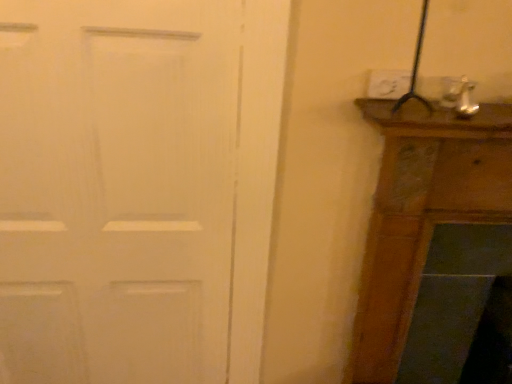
At what (x,y) coordinates should I click in order to perform the action: click on white plastic electric outlet at upper right. Please return your answer as a coordinate pair (x, y). The width and height of the screenshot is (512, 384). Looking at the image, I should click on (388, 84).

The width and height of the screenshot is (512, 384). What do you see at coordinates (388, 84) in the screenshot? I see `white plastic electric outlet at upper right` at bounding box center [388, 84].

Image resolution: width=512 pixels, height=384 pixels. Describe the element at coordinates (117, 189) in the screenshot. I see `white matte door at left` at that location.

Locate an element on the screen. white matte door at left is located at coordinates (117, 189).

Where is `white plastic electric outlet at upper right`? The image size is (512, 384). white plastic electric outlet at upper right is located at coordinates (388, 84).

Is white matte door at left at the left side of white plastic electric outlet at upper right?

Yes, white matte door at left is to the left of white plastic electric outlet at upper right.

Is white matte door at left in front of or behind white plastic electric outlet at upper right in the image?

Clearly, white matte door at left is in front of white plastic electric outlet at upper right.

Considering the positions of points (129, 63) and (401, 93), is point (129, 63) farther from camera compared to point (401, 93)?

That is False.

From the image's perspective, who appears lower, white matte door at left or white plastic electric outlet at upper right?

white matte door at left.

From a real-world perspective, is white matte door at left on white plastic electric outlet at upper right?

Actually, white matte door at left is physically below white plastic electric outlet at upper right in the real world.

Considering the sizes of objects white matte door at left and white plastic electric outlet at upper right in the image provided, who is thinner, white matte door at left or white plastic electric outlet at upper right?

Thinner between the two is white plastic electric outlet at upper right.

Considering the sizes of white matte door at left and white plastic electric outlet at upper right in the image, is white matte door at left taller or shorter than white plastic electric outlet at upper right?

white matte door at left is taller than white plastic electric outlet at upper right.

Who is smaller, white matte door at left or white plastic electric outlet at upper right?

white plastic electric outlet at upper right.

Can we say white matte door at left lies outside white plastic electric outlet at upper right?

That's correct, white matte door at left is outside of white plastic electric outlet at upper right.

Are white matte door at left and white plastic electric outlet at upper right located far from each other?

No, there isn't a large distance between white matte door at left and white plastic electric outlet at upper right.

Is white matte door at left facing towards white plastic electric outlet at upper right?

No, white matte door at left does not turn towards white plastic electric outlet at upper right.

What's the angular difference between white matte door at left and white plastic electric outlet at upper right's facing directions?

white matte door at left and white plastic electric outlet at upper right are facing 4.25 degrees away from each other.

There is a white matte door at left. Identify the location of electric outlet above it (from a real-world perspective). (388, 84).

Visually, is white plastic electric outlet at upper right positioned to the left or to the right of white matte door at left?

From the image, it's evident that white plastic electric outlet at upper right is to the right of white matte door at left.

Is white plastic electric outlet at upper right in front of or behind white matte door at left in the image?

white plastic electric outlet at upper right is behind white matte door at left.

Does point (400, 95) lie behind point (159, 277)?

No, (400, 95) is in front of (159, 277).

From the image's perspective, which is above, white plastic electric outlet at upper right or white matte door at left?

From the image's view, white plastic electric outlet at upper right is above.

From a real-world perspective, does white plastic electric outlet at upper right sit lower than white matte door at left?

No, from a real-world perspective, white plastic electric outlet at upper right is not under white matte door at left.

Between white plastic electric outlet at upper right and white matte door at left, which one has larger width?

With larger width is white matte door at left.

Considering the sizes of objects white plastic electric outlet at upper right and white matte door at left in the image provided, who is taller, white plastic electric outlet at upper right or white matte door at left?

white matte door at left is taller.

Can you confirm if white plastic electric outlet at upper right is bigger than white matte door at left?

No, white plastic electric outlet at upper right is not bigger than white matte door at left.

Which is correct: white plastic electric outlet at upper right is inside white matte door at left, or outside of it?

white plastic electric outlet at upper right is located beyond the bounds of white matte door at left.

Is white plastic electric outlet at upper right directly adjacent to white matte door at left?

white plastic electric outlet at upper right and white matte door at left are not in contact.

Is white plastic electric outlet at upper right oriented towards white matte door at left?

No, white plastic electric outlet at upper right is not aimed at white matte door at left.

Based on the photo, can you tell me how much white plastic electric outlet at upper right and white matte door at left differ in facing direction?

They differ by 4.25 degrees in their facing directions.

You are a GUI agent. You are given a task and a screenshot of the screen. Output one action in this format:
    pyautogui.click(x=<x>, y=<y>)
    Task: Click on the electric outlet behind the white matte door at left
    
    Given the screenshot: What is the action you would take?
    pyautogui.click(x=388, y=84)

The height and width of the screenshot is (384, 512). Find the location of `electric outlet above the white matte door at left (from a real-world perspective)`. electric outlet above the white matte door at left (from a real-world perspective) is located at coordinates [x=388, y=84].

Where is `door on the left side of white plastic electric outlet at upper right`? door on the left side of white plastic electric outlet at upper right is located at coordinates (117, 189).